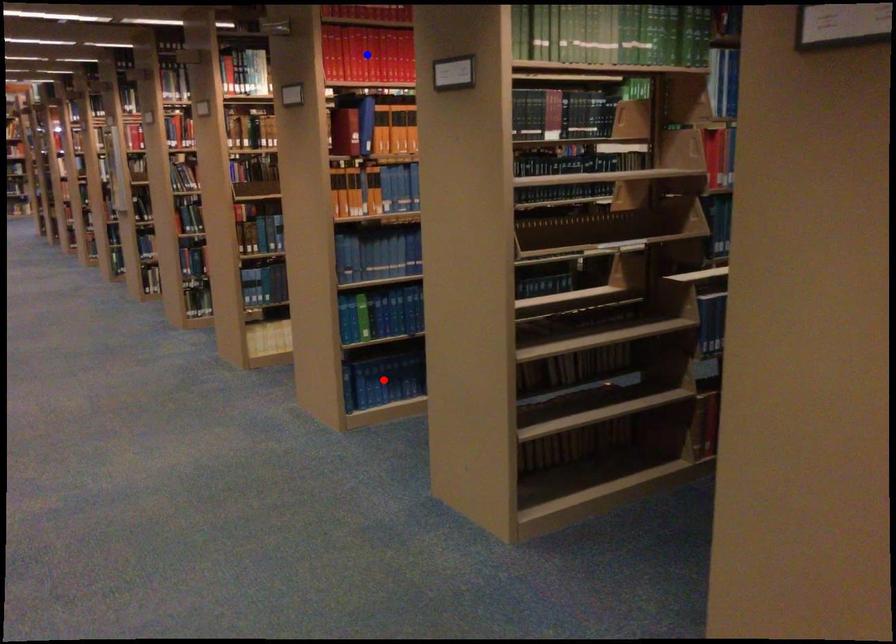
Question: Which of the two points in the image is closer to the camera?

Choices:
 (A) Blue point is closer.
 (B) Red point is closer.

Answer: (A)